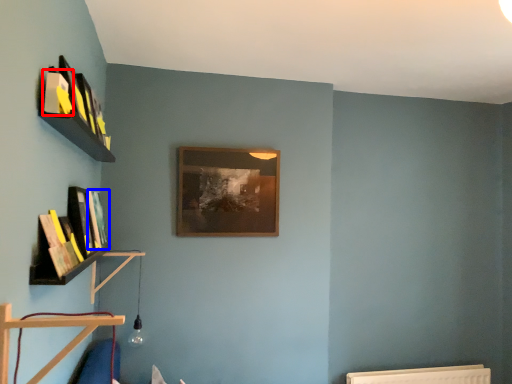
Question: Among these objects, which one is nearest to the camera, book (highlighted by a red box) or book (highlighted by a blue box)?

Choices:
 (A) book
 (B) book

Answer: (A)